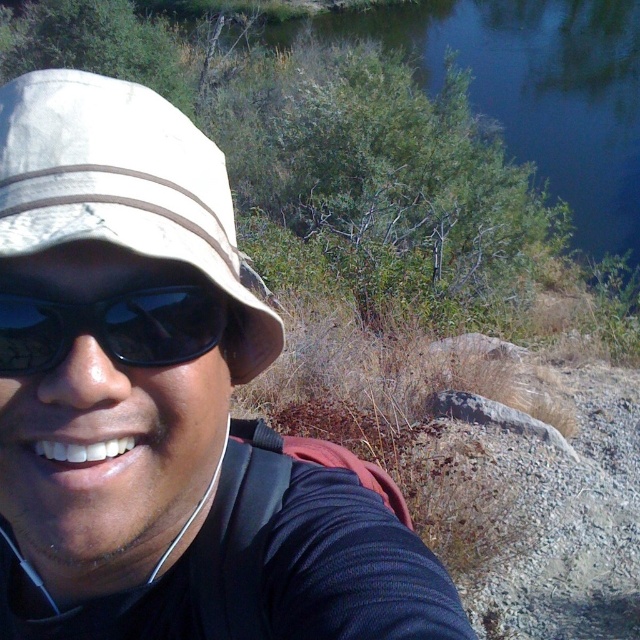
Question: Does white matte hat at upper left lie in front of blue water at upper center?

Choices:
 (A) yes
 (B) no

Answer: (A)

Question: Does blue water at upper center appear on the right side of black matte sunglasses at left?

Choices:
 (A) no
 (B) yes

Answer: (B)

Question: Among these objects, which one is nearest to the camera?

Choices:
 (A) black matte sunglasses at left
 (B) blue water at upper center
 (C) white matte hat at upper left

Answer: (C)

Question: Estimate the real-world distances between objects in this image. Which object is farther from the blue water at upper center?

Choices:
 (A) white fabric hat at left
 (B) white matte hat at upper left
 (C) black matte sunglasses at left

Answer: (A)

Question: Which point appears closest to the camera in this image?

Choices:
 (A) (208, 192)
 (B) (621, 118)
 (C) (20, 365)

Answer: (C)

Question: Is white matte hat at upper left smaller than black matte sunglasses at left?

Choices:
 (A) yes
 (B) no

Answer: (B)